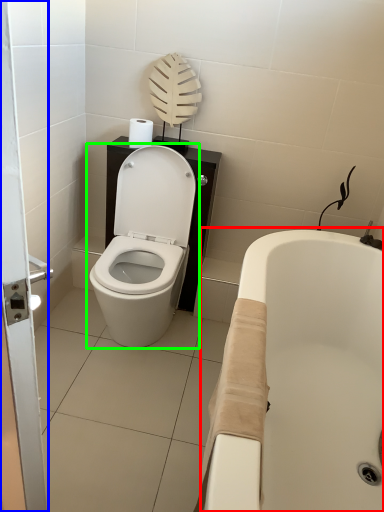
Question: Estimate the real-world distances between objects in this image. Which object is closer to bath (highlighted by a red box), screen door (highlighted by a blue box) or toilet (highlighted by a green box)?

Choices:
 (A) screen door
 (B) toilet

Answer: (B)